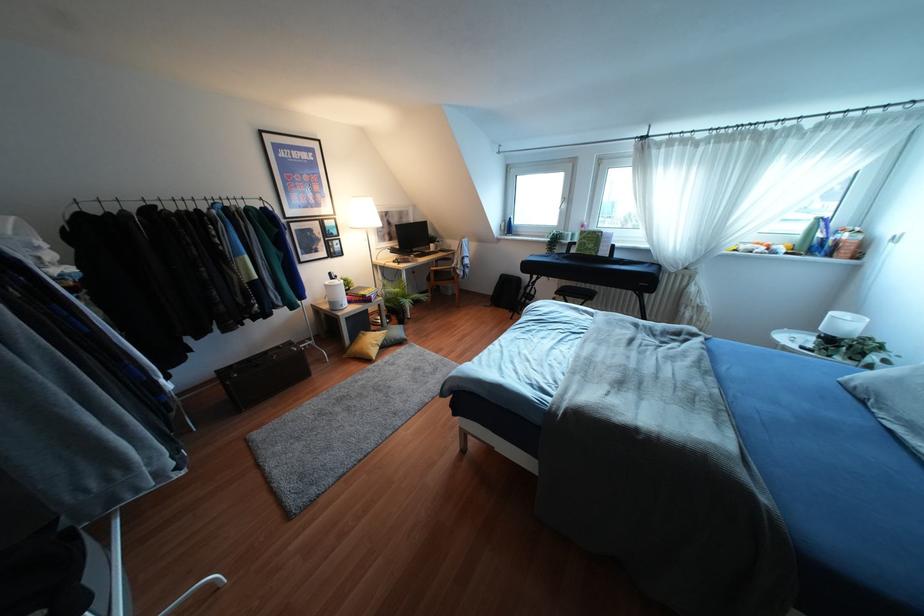
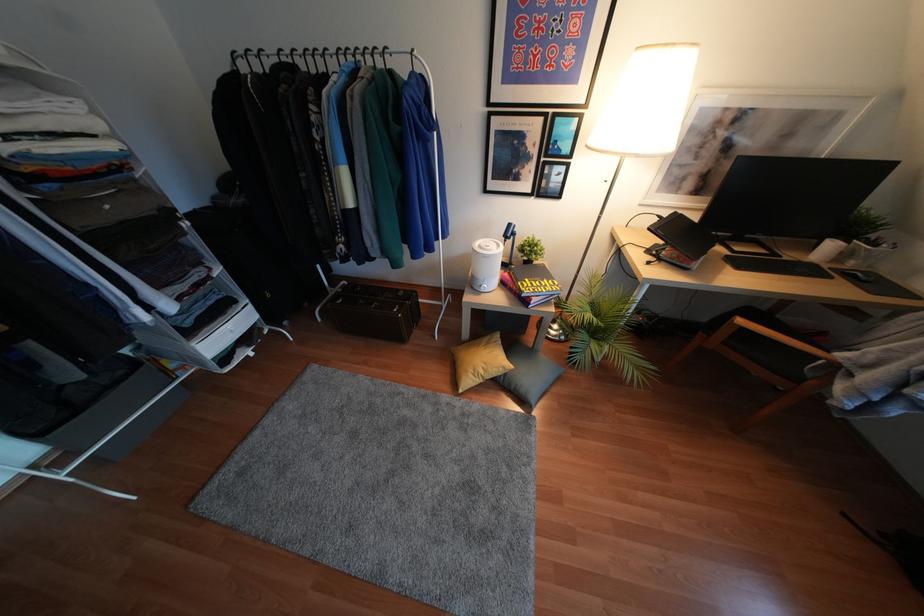
Question: I am providing you with two images of the same scene from different viewpoints. Please identify which objects are invisible in image2.

Choices:
 (A) small potted plant
 (B) black clothes hanger
 (C) black drawing tablet
 (D) none of these

Answer: (D)